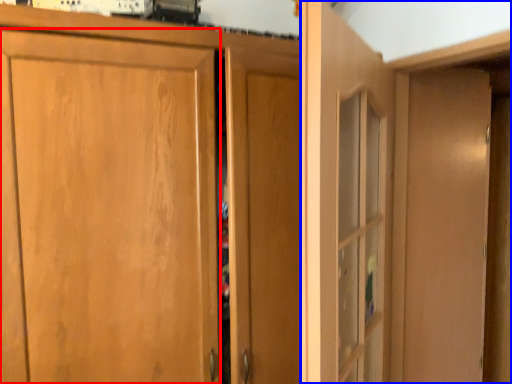
Question: Which point is further to the camera, door (highlighted by a red box) or dresser (highlighted by a blue box)?

Choices:
 (A) door
 (B) dresser

Answer: (B)